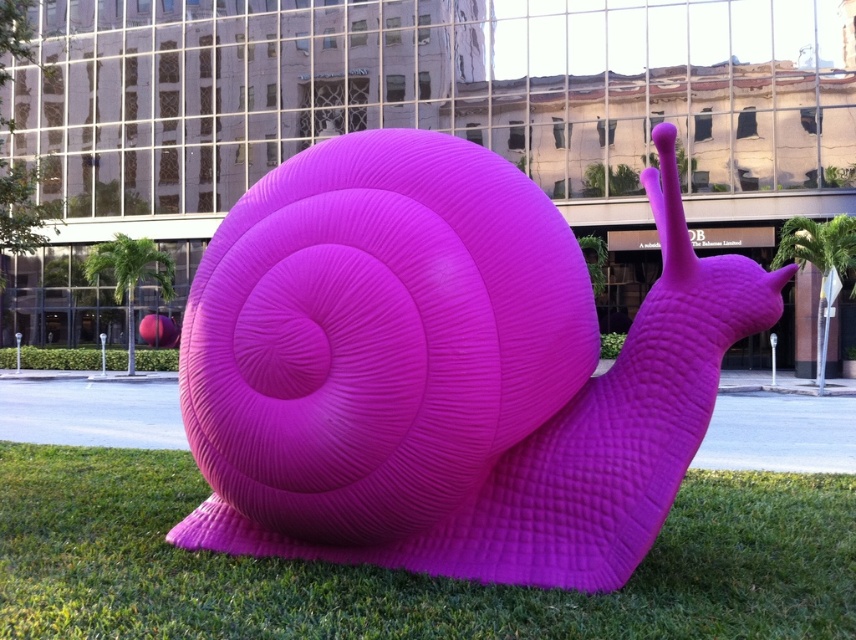
You are a gardener who needs to mow the lawn. The matte plastic snail at center is in the way. Can you move it to the side so that you can mow the green grass at center?

The matte plastic snail at center is located above green grass at center, so you can move the matte plastic snail at center to the side to access the green grass at center for mowing.

You are a gardener checking the visibility of the matte plastic snail at center in the urban garden. Since the green grass at center is growing around it, will the snail be mostly visible or mostly hidden?

The matte plastic snail at center is taller than green grass at center, so the snail will be mostly visible.

You are standing in the urban setting shown in the image. You see a point at coordinates (444,369). Which object is this point located on?

The point at coordinates (444,369) is located on the matte plastic snail at center.